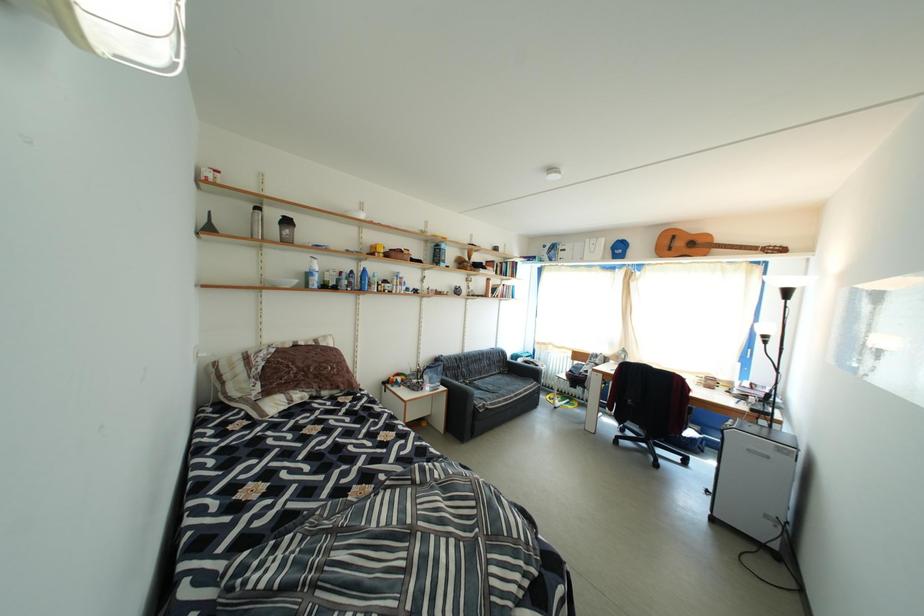
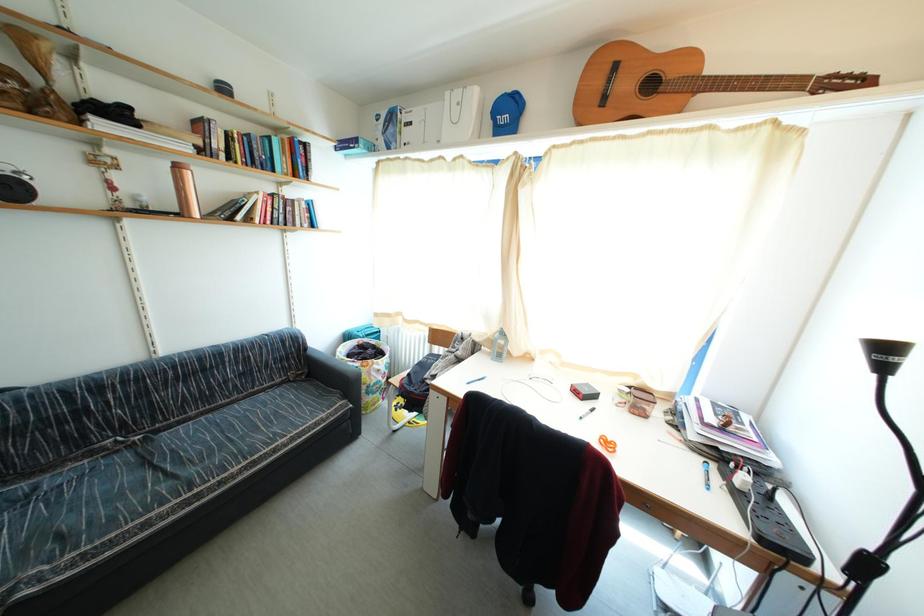
Which direction would the cameraman need to move to produce the second image?

The cameraman moved toward right, forward.